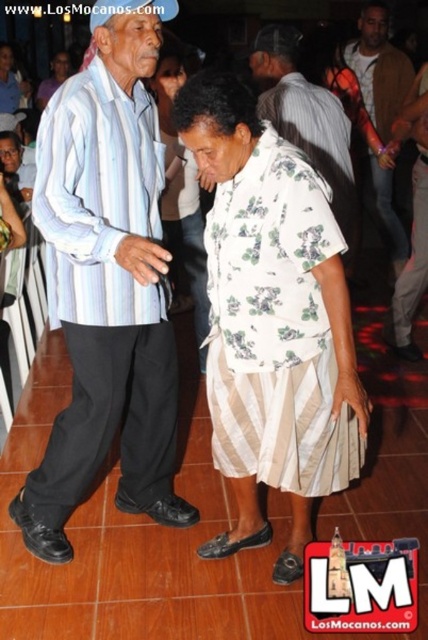
You are standing at the entrance of the event and want to find the striped cotton shirt at center. According to the coordinates provided, in which direction should you look relative to the entrance?

The striped cotton shirt at center is located at coordinates point (x=107, y=284), which would be to the right and slightly forward from the entrance.